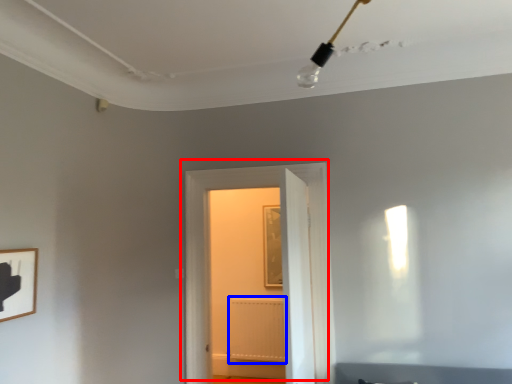
Question: Which object appears farthest to the camera in this image, door (highlighted by a red box) or radiator (highlighted by a blue box)?

Choices:
 (A) door
 (B) radiator

Answer: (B)